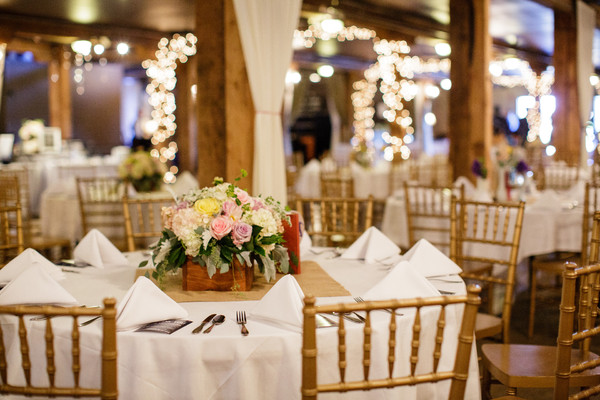
This screenshot has height=400, width=600. I want to click on fork, so click(241, 316).